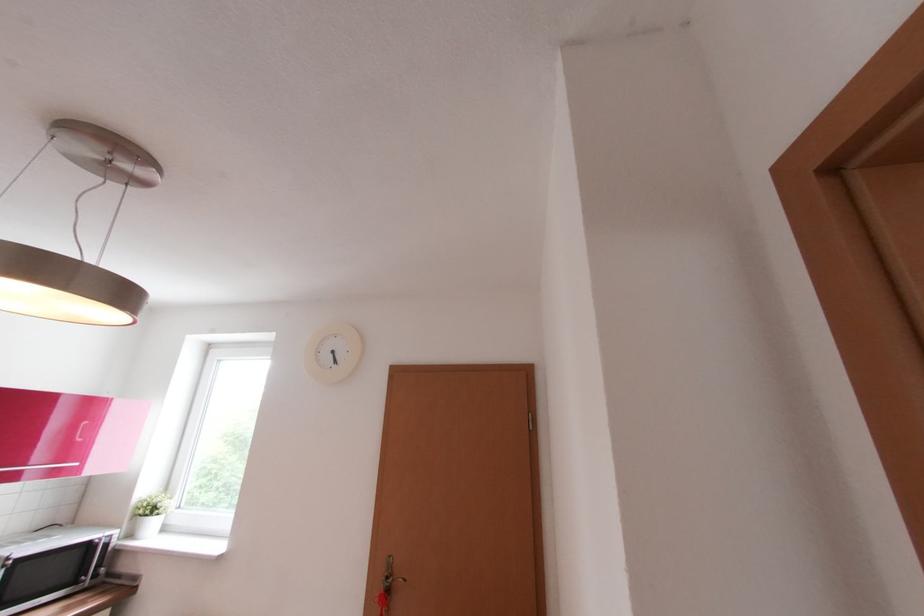
The width and height of the screenshot is (924, 616). What do you see at coordinates (38, 469) in the screenshot?
I see `the red cabinet handle` at bounding box center [38, 469].